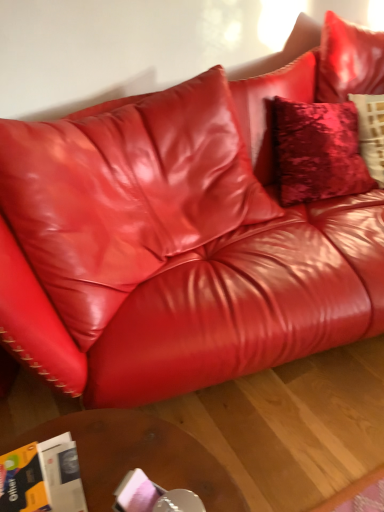
In order to face orange glossy magazine at lower left, should I rotate leftwards or rightwards?

You should rotate left by 23.871 degrees.

Describe the element at coordinates (42, 478) in the screenshot. I see `orange glossy magazine at lower left` at that location.

What is the approximate width of orange glossy magazine at lower left?

9.69 inches.

Based on the photo, what is the approximate height of orange glossy magazine at lower left?

orange glossy magazine at lower left is 3.44 inches in height.

Where is `orange glossy magazine at lower left`? This screenshot has height=512, width=384. orange glossy magazine at lower left is located at coordinates (42, 478).

Locate an element on the screen. This screenshot has height=512, width=384. brown wooden table at lower center is located at coordinates (138, 457).

What do you see at coordinates (138, 457) in the screenshot? This screenshot has width=384, height=512. I see `brown wooden table at lower center` at bounding box center [138, 457].

Image resolution: width=384 pixels, height=512 pixels. Find the location of `orange glossy magazine at lower left`. orange glossy magazine at lower left is located at coordinates (42, 478).

Is brown wooden table at lower center to the left or to the right of orange glossy magazine at lower left in the image?

From the image, it's evident that brown wooden table at lower center is to the right of orange glossy magazine at lower left.

Is brown wooden table at lower center in front of or behind orange glossy magazine at lower left in the image?

In the image, brown wooden table at lower center appears behind orange glossy magazine at lower left.

Which is more distant, (99, 432) or (6, 490)?

Positioned behind is point (99, 432).

From the image's perspective, relative to orange glossy magazine at lower left, is brown wooden table at lower center above or below?

brown wooden table at lower center is situated lower than orange glossy magazine at lower left in the image.

From a real-world perspective, which is physically below, brown wooden table at lower center or orange glossy magazine at lower left?

From a 3D spatial view, brown wooden table at lower center is below.

Which of these two, brown wooden table at lower center or orange glossy magazine at lower left, is thinner?

orange glossy magazine at lower left.

In the scene shown: Considering the sizes of brown wooden table at lower center and orange glossy magazine at lower left in the image, is brown wooden table at lower center taller or shorter than orange glossy magazine at lower left?

brown wooden table at lower center is taller than orange glossy magazine at lower left.

In terms of size, does brown wooden table at lower center appear bigger or smaller than orange glossy magazine at lower left?

Considering their sizes, brown wooden table at lower center takes up more space than orange glossy magazine at lower left.

Is brown wooden table at lower center positioned beyond the bounds of orange glossy magazine at lower left?

brown wooden table at lower center is positioned outside orange glossy magazine at lower left.

In the scene shown: Are brown wooden table at lower center and orange glossy magazine at lower left far apart?

No, there isn't a large distance between brown wooden table at lower center and orange glossy magazine at lower left.

Is brown wooden table at lower center oriented towards orange glossy magazine at lower left?

No.

Image resolution: width=384 pixels, height=512 pixels. I want to click on table below the orange glossy magazine at lower left (from the image's perspective), so click(138, 457).

Can you confirm if orange glossy magazine at lower left is positioned to the right of brown wooden table at lower center?

In fact, orange glossy magazine at lower left is to the left of brown wooden table at lower center.

Which object is more forward, orange glossy magazine at lower left or brown wooden table at lower center?

orange glossy magazine at lower left is more forward.

Is point (53, 444) positioned after point (77, 443)?

No, (53, 444) is in front of (77, 443).

From the image's perspective, is orange glossy magazine at lower left located beneath brown wooden table at lower center?

No.

From a real-world perspective, which object stands above the other?

In real-world perspective, orange glossy magazine at lower left is above.

Considering the sizes of objects orange glossy magazine at lower left and brown wooden table at lower center in the image provided, who is thinner, orange glossy magazine at lower left or brown wooden table at lower center?

orange glossy magazine at lower left is thinner.

Considering the sizes of orange glossy magazine at lower left and brown wooden table at lower center in the image, is orange glossy magazine at lower left taller or shorter than brown wooden table at lower center?

In the image, orange glossy magazine at lower left appears to be shorter than brown wooden table at lower center.

Considering the relative sizes of orange glossy magazine at lower left and brown wooden table at lower center in the image provided, is orange glossy magazine at lower left bigger than brown wooden table at lower center?

No, orange glossy magazine at lower left is not bigger than brown wooden table at lower center.

Is orange glossy magazine at lower left completely or partially outside of brown wooden table at lower center?

Yes, orange glossy magazine at lower left is not within brown wooden table at lower center.

Is orange glossy magazine at lower left next to brown wooden table at lower center and touching it?

orange glossy magazine at lower left is not next to brown wooden table at lower center, and they're not touching.

Is orange glossy magazine at lower left oriented away from brown wooden table at lower center?

No, orange glossy magazine at lower left is not facing the opposite direction of brown wooden table at lower center.

Find the location of a particular element. table behind the orange glossy magazine at lower left is located at coordinates (138, 457).

The height and width of the screenshot is (512, 384). Identify the location of table that appears behind the orange glossy magazine at lower left. (138, 457).

Find the location of a particular element. The image size is (384, 512). magazine to the left of brown wooden table at lower center is located at coordinates (42, 478).